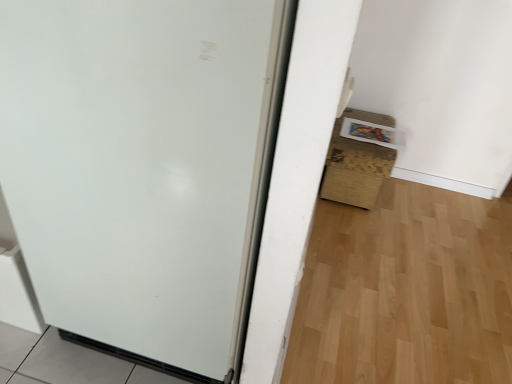
This screenshot has height=384, width=512. Identify the location of vacant area that is situated to the right of white matte door at center. (349, 312).